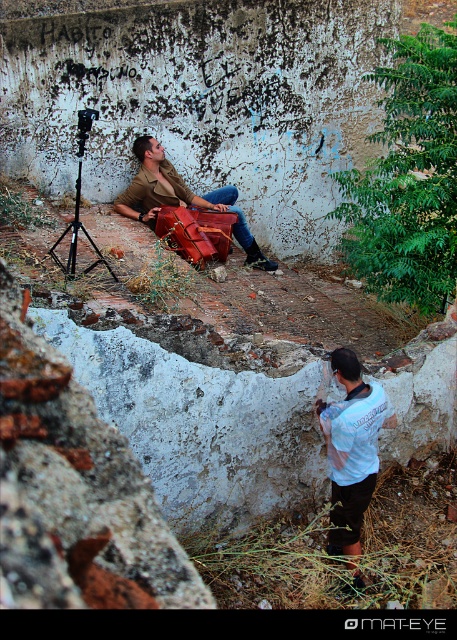
Is white cotton shirt at lower right bigger than leather suitcase at center?

No, white cotton shirt at lower right is not bigger than leather suitcase at center.

Who is taller, white cotton shirt at lower right or leather suitcase at center?

With more height is leather suitcase at center.

Is point (344, 433) in front of point (173, 204)?

Yes, it is in front of point (173, 204).

Find the location of a particular element. The image size is (457, 640). white cotton shirt at lower right is located at coordinates (351, 449).

Find the location of a particular element. white cotton shirt at lower right is located at coordinates (351, 449).

Between point (380, 394) and point (59, 237), which one is positioned behind?

Positioned behind is point (59, 237).

Image resolution: width=457 pixels, height=640 pixels. Find the location of `white cotton shirt at lower right`. white cotton shirt at lower right is located at coordinates (351, 449).

Is leather suitcase at center positioned before black matte tripod at center?

That is False.

Can you confirm if leather suitcase at center is bigger than black matte tripod at center?

Yes, leather suitcase at center is bigger than black matte tripod at center.

Does point (154, 141) come closer to viewer compared to point (99, 250)?

No, (154, 141) is behind (99, 250).

At what (x,y) coordinates should I click in order to perform the action: click on leather suitcase at center. Please return your answer as a coordinate pair (x, y). Image resolution: width=457 pixels, height=640 pixels. Looking at the image, I should click on (180, 196).